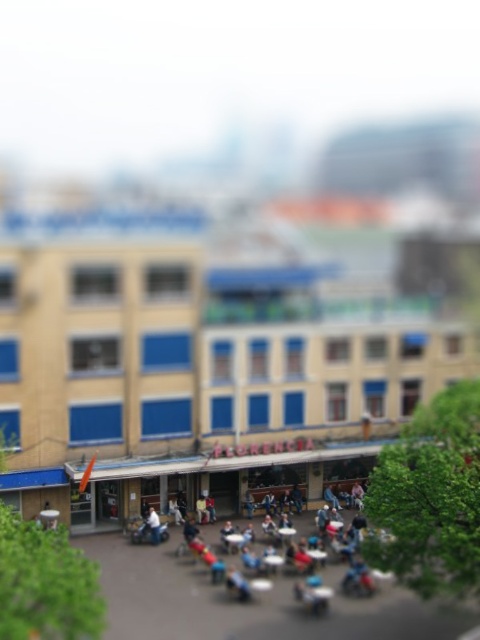
You are standing at the entrance of the miniature street scene and want to place a small decoration exactly at the center of the blue fabric chair at center. According to the coordinates provided, where should you aim your placement?

The blue fabric chair at center is located at point (196, 541), so you should aim your placement at those coordinates to place the decoration exactly at its center.

From the picture: You are standing at the point with coordinates point (217, 561) and want to walk to the point with coordinates point (157, 520). Which direction should you move to get closer to your destination?

You should move away from the viewer because point (157, 520) is further from the viewer than point (217, 561).